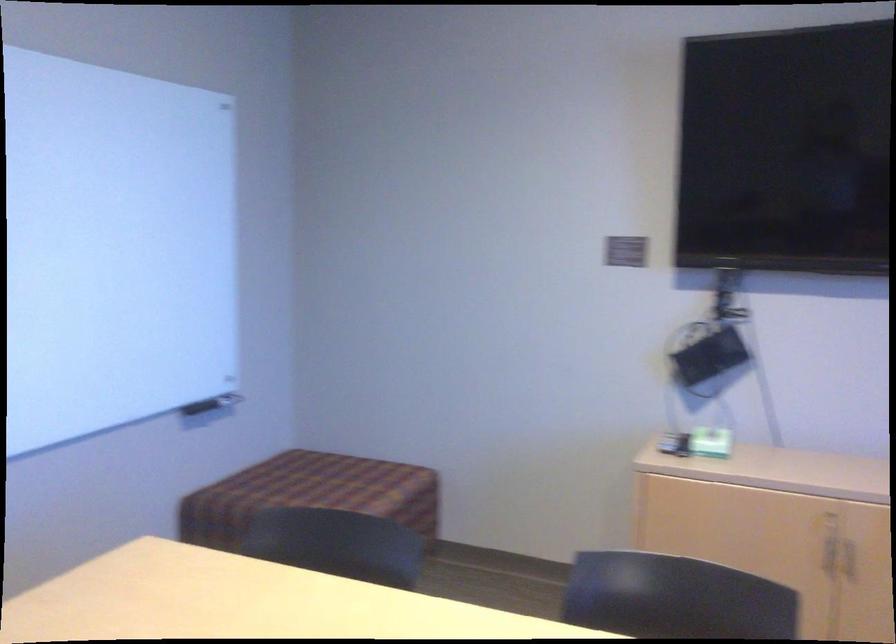
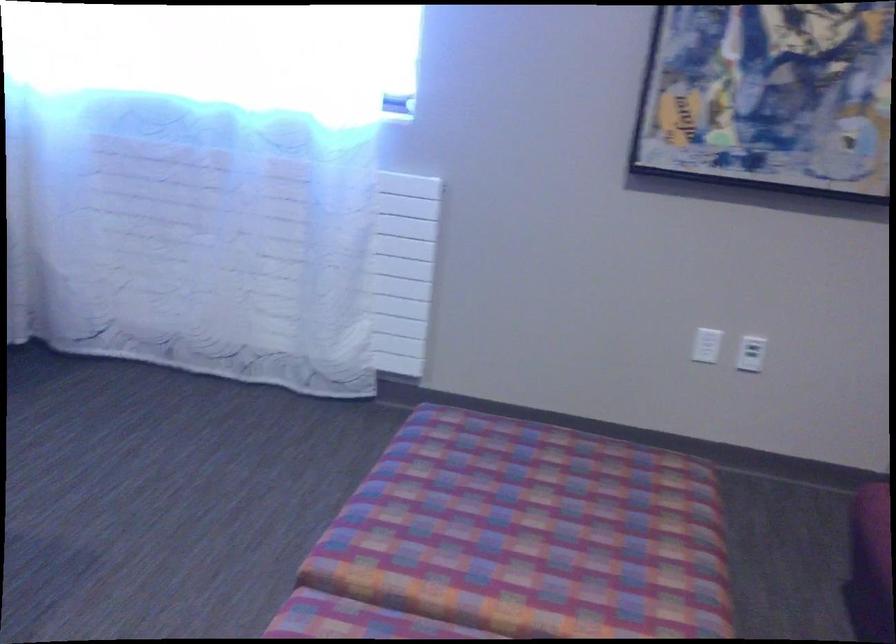
The first image is from the beginning of the video and the second image is from the end. How did the camera likely rotate when shooting the video?

The camera rotated toward right-down.